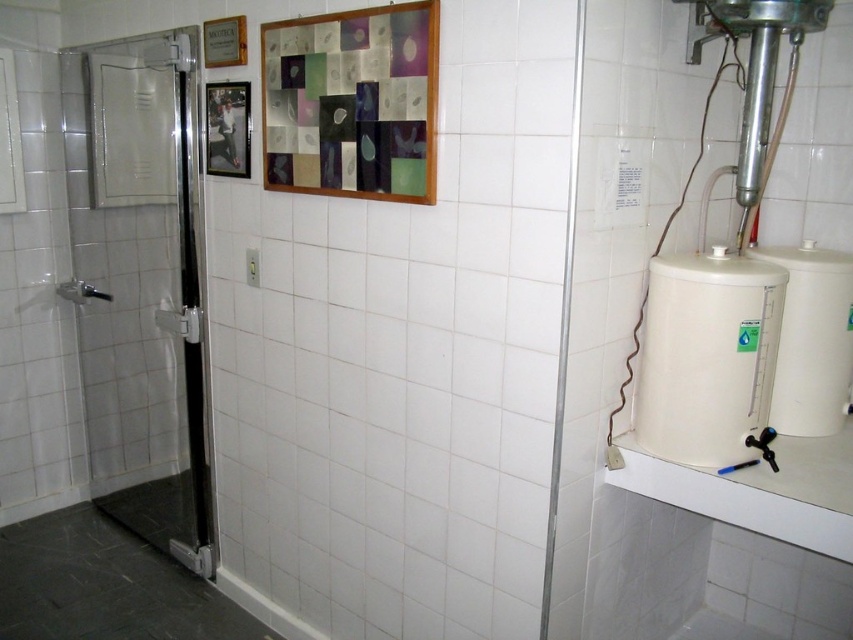
You are an inspector checking the utility area. You need to determine if the white matte water tank at right can fit through the doorway. The doorway is the same width as the metallic silver picture frame at upper left. Can the water tank fit through the doorway?

The white matte water tank at right is bigger than the metallic silver picture frame at upper left. Since the doorway is the same width as the metallic silver picture frame at upper left, the water tank cannot fit through the doorway because it is larger than the frame and thus wider than the doorway.

You are a maintenance worker needing to access the water tank. The path between the transparent glass door at left and the white matte water tank at right is 1.71 meters. Can you walk through this path to reach the tank?

The path between the transparent glass door at left and the white matte water tank at right is 1.71 meters. Since the average width of a person is about 0.5 meters, there is sufficient space for you to walk through the path to reach the tank.

You are a delivery person who needs to move a large box through the transparent glass door at left and the white matte water tank at right. Which object has a wider opening to allow the box to pass through?

The transparent glass door at left has a larger width than the white matte water tank at right, so the box can pass through the transparent glass door at left more easily.